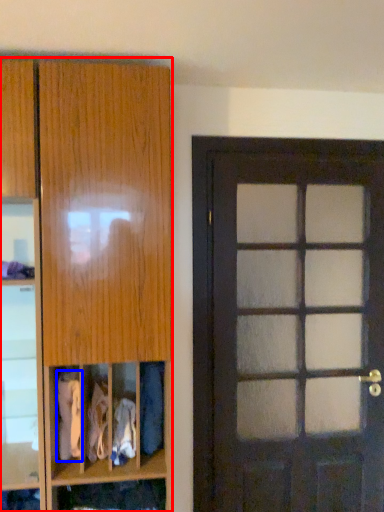
Question: Among these objects, which one is nearest to the camera, cabinetry (highlighted by a red box) or clothing (highlighted by a blue box)?

Choices:
 (A) cabinetry
 (B) clothing

Answer: (A)